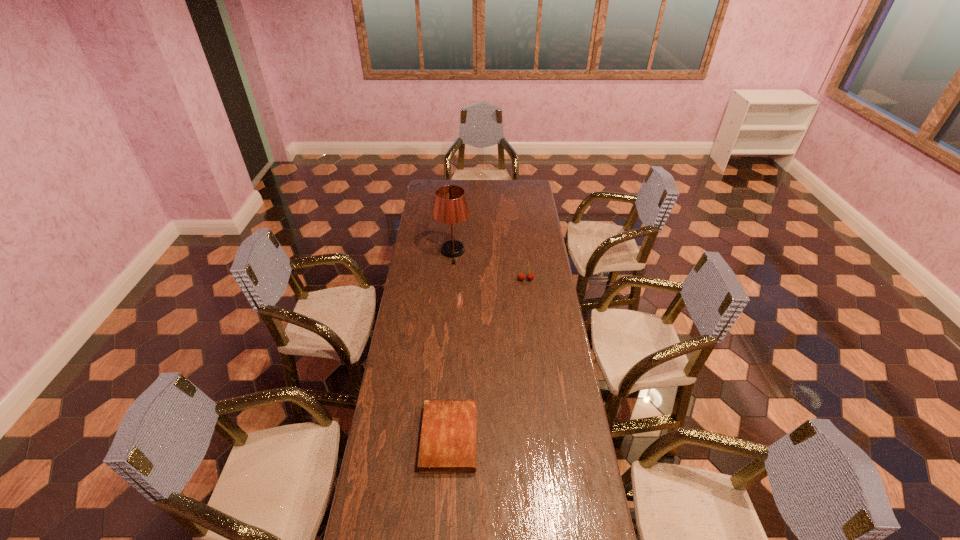
Locate an element on the screen. object situated at the right edge is located at coordinates (521, 276).

In the image, there is a desktop. At what (x,y) coordinates should I click in order to perform the action: click on blank space at the far edge. Please return your answer as a coordinate pair (x, y). Looking at the image, I should click on (480, 195).

The width and height of the screenshot is (960, 540). In the image, there is a desktop. What are the coordinates of `free space at the left edge` in the screenshot? It's located at (431, 265).

The width and height of the screenshot is (960, 540). In the image, there is a desktop. Identify the location of vacant region at the right edge. (540, 245).

The image size is (960, 540). I want to click on vacant space at the far right corner of the desktop, so click(x=533, y=194).

Locate an element on the screen. free space between the farthest object and the Bible is located at coordinates (451, 345).

Image resolution: width=960 pixels, height=540 pixels. I want to click on vacant point located between the nearest object and the farthest object, so click(451, 345).

At what (x,y) coordinates should I click in order to perform the action: click on free space between the lampshade and the nearest object. Please return your answer as a coordinate pair (x, y). The image size is (960, 540). Looking at the image, I should click on (451, 345).

This screenshot has width=960, height=540. I want to click on free space that is in between the lampshade and the shortest object, so click(x=451, y=345).

Find the location of a particular element. The height and width of the screenshot is (540, 960). unoccupied position between the nearest object and the second nearest object is located at coordinates coord(488,359).